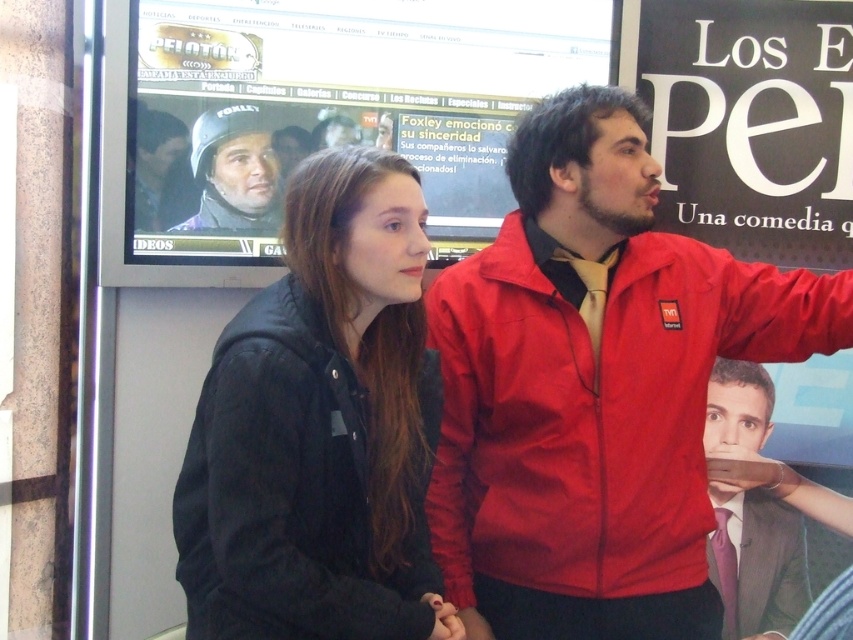
Between point (727, 417) and point (251, 134), which one is positioned in front?

Point (251, 134) is in front.

Which is above, smooth suit at center or matte black helmet at upper center?

matte black helmet at upper center

Which is in front, point (746, 609) or point (234, 108)?

Point (234, 108)

I want to click on smooth suit at center, so click(x=757, y=563).

Based on the photo, which of these two, matte red jacket at center or matte black helmet at upper center, stands shorter?

matte black helmet at upper center is shorter.

Is point (666, 260) farther from camera compared to point (218, 220)?

No, it is in front of (218, 220).

At what (x,y) coordinates should I click in order to perform the action: click on matte red jacket at center. Please return your answer as a coordinate pair (x, y). The height and width of the screenshot is (640, 853). Looking at the image, I should click on pos(595,387).

Does matte black jacket at center appear under matte black helmet at upper center?

Indeed, matte black jacket at center is positioned under matte black helmet at upper center.

Describe the element at coordinates (318, 428) in the screenshot. Image resolution: width=853 pixels, height=640 pixels. I see `matte black jacket at center` at that location.

Locate an element on the screen. The image size is (853, 640). matte black jacket at center is located at coordinates (318, 428).